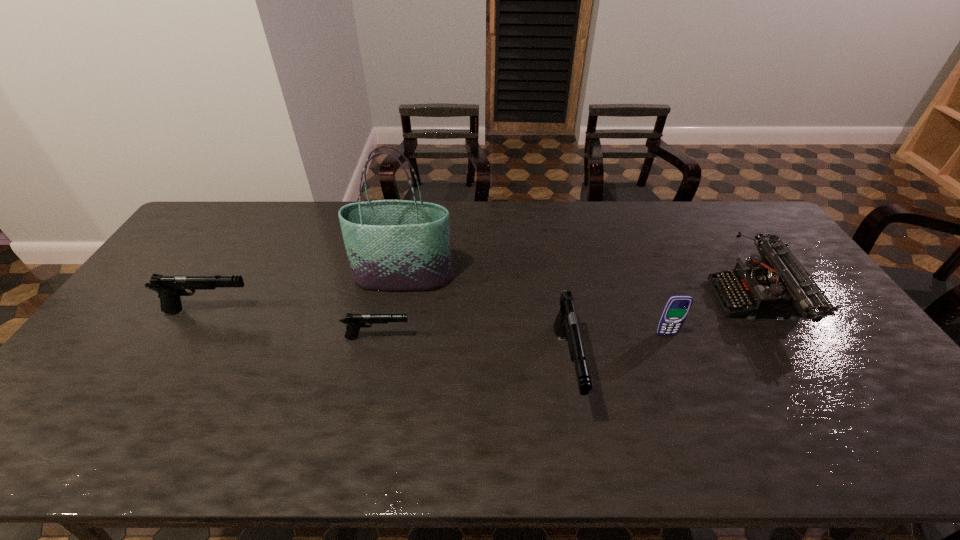
The image size is (960, 540). Find the location of `vacant space at the left edge of the desktop`. vacant space at the left edge of the desktop is located at coordinates (93, 352).

Where is `vacant space at the right edge`? Image resolution: width=960 pixels, height=540 pixels. vacant space at the right edge is located at coordinates (806, 348).

Where is `vacant region at the far left corner of the desktop`? Image resolution: width=960 pixels, height=540 pixels. vacant region at the far left corner of the desktop is located at coordinates (250, 207).

Locate an element on the screen. The image size is (960, 540). free location at the near left corner of the desktop is located at coordinates pos(56,400).

Identify the location of vacant space at the far right corner of the desktop. The width and height of the screenshot is (960, 540). (732, 213).

At what (x,y) coordinates should I click in order to perform the action: click on empty space between the fifth object from left to right and the third object from right to left. Please return your answer as a coordinate pair (x, y). This screenshot has width=960, height=540. Looking at the image, I should click on (616, 351).

Locate an element on the screen. empty space that is in between the tallest object and the third object from right to left is located at coordinates (485, 322).

In order to click on free area in between the second gun from left to right and the third object from right to left in this screenshot , I will do `click(472, 352)`.

The height and width of the screenshot is (540, 960). I want to click on free point between the second gun from right to left and the tote bag, so click(x=390, y=308).

The image size is (960, 540). I want to click on free space between the typewriter and the tallest object, so click(580, 289).